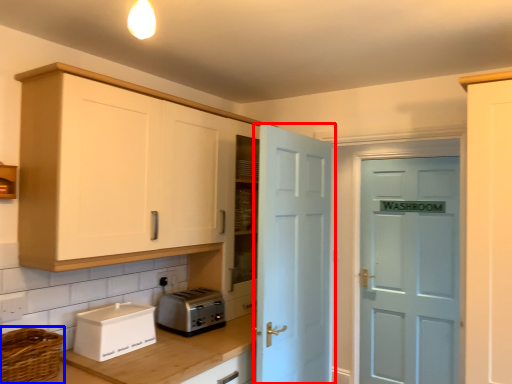
Question: Which object is closer to the camera taking this photo, door (highlighted by a red box) or basket (highlighted by a blue box)?

Choices:
 (A) door
 (B) basket

Answer: (B)